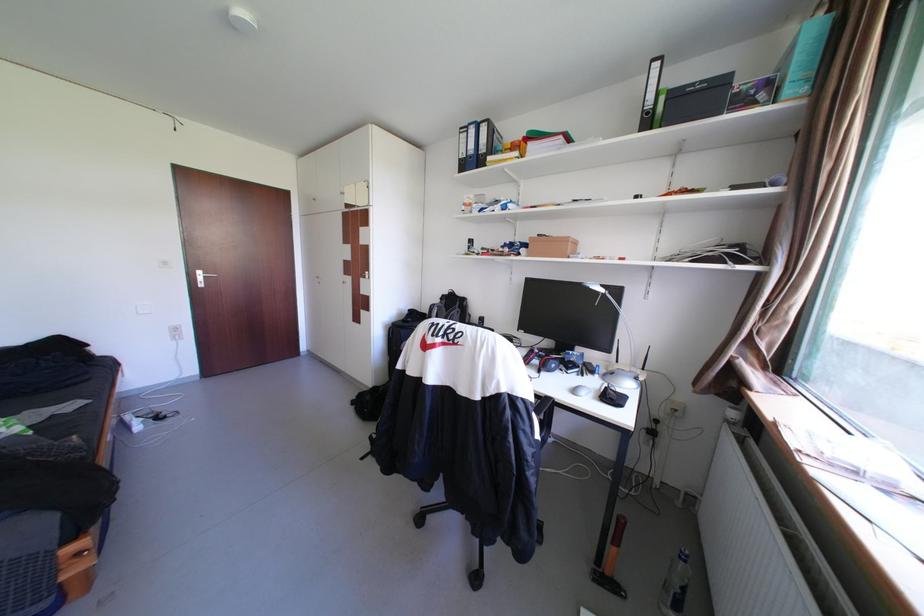
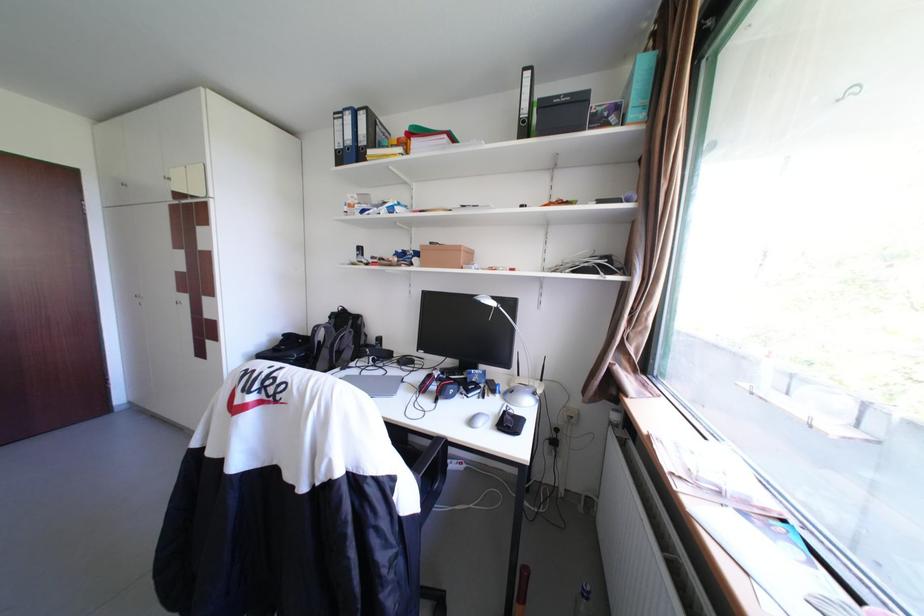
In the second image, find the point that corresponds to (659,113) in the first image.

(535, 122)